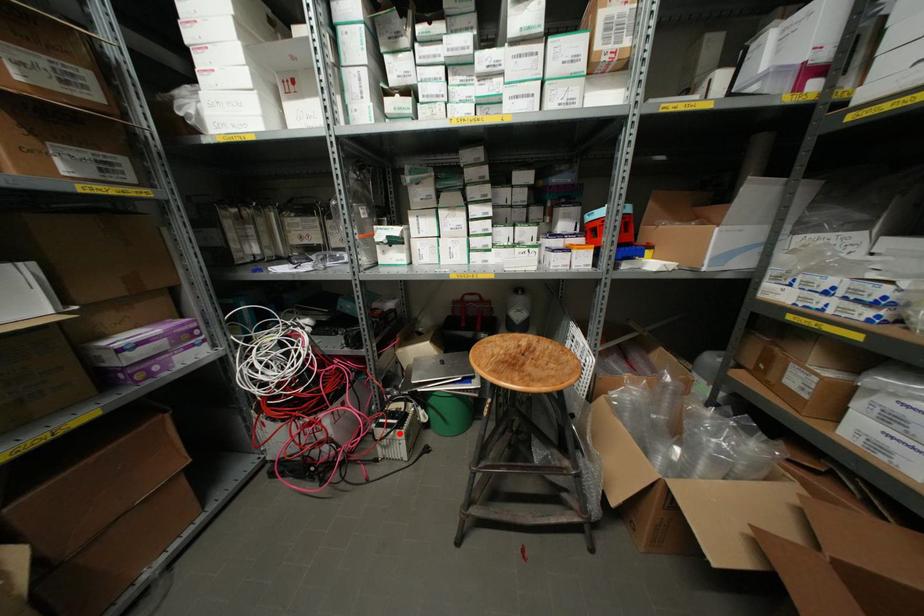
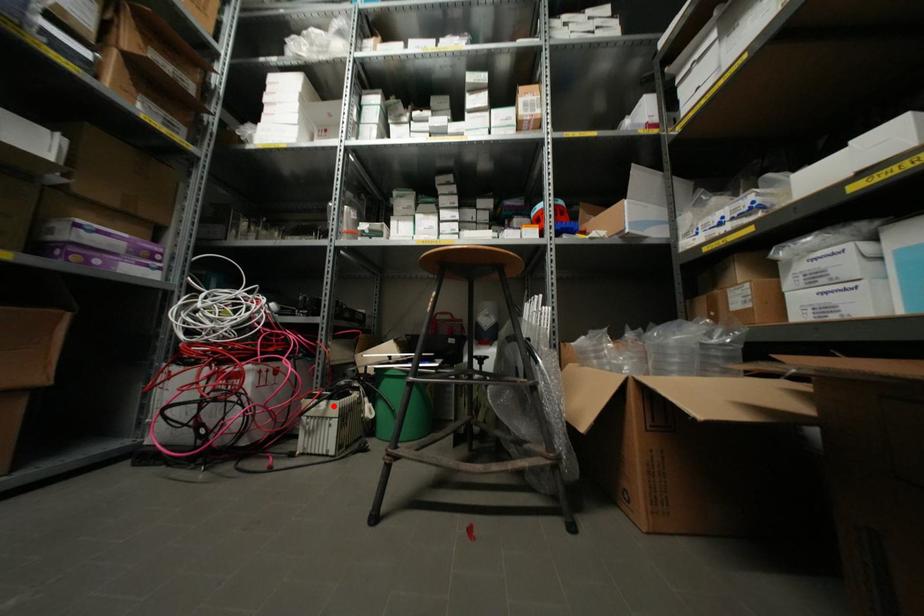
I am providing you with two images of the same scene from different viewpoints. A red point is marked on the first image and another point is marked on the second image. Does the point marked in image1 correspond to the same location as the one in image2?

Yes